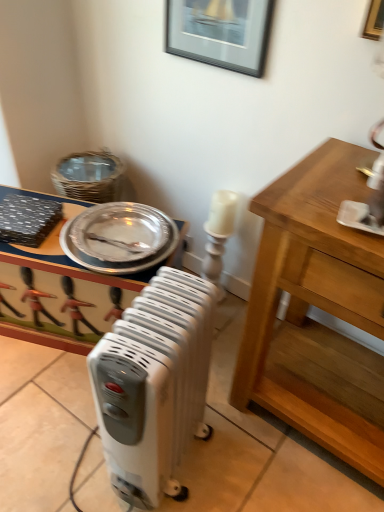
Question: Considering the positions of silver metallic platter at upper left and black glossy picture frame at upper center in the image, is silver metallic platter at upper left taller or shorter than black glossy picture frame at upper center?

Choices:
 (A) tall
 (B) short

Answer: (B)

Question: Is silver metallic platter at upper left in front of or behind black glossy picture frame at upper center in the image?

Choices:
 (A) front
 (B) behind

Answer: (B)

Question: Estimate the real-world distances between objects in this image. Which object is closer to the white plastic radiator at center?

Choices:
 (A) silver metallic platter at upper left
 (B) black glossy picture frame at upper center
 (C) metallic silver tray at center

Answer: (A)

Question: Which of these objects is positioned farthest from the metallic silver tray at center?

Choices:
 (A) silver metallic platter at upper left
 (B) white plastic radiator at center
 (C) black glossy picture frame at upper center

Answer: (C)